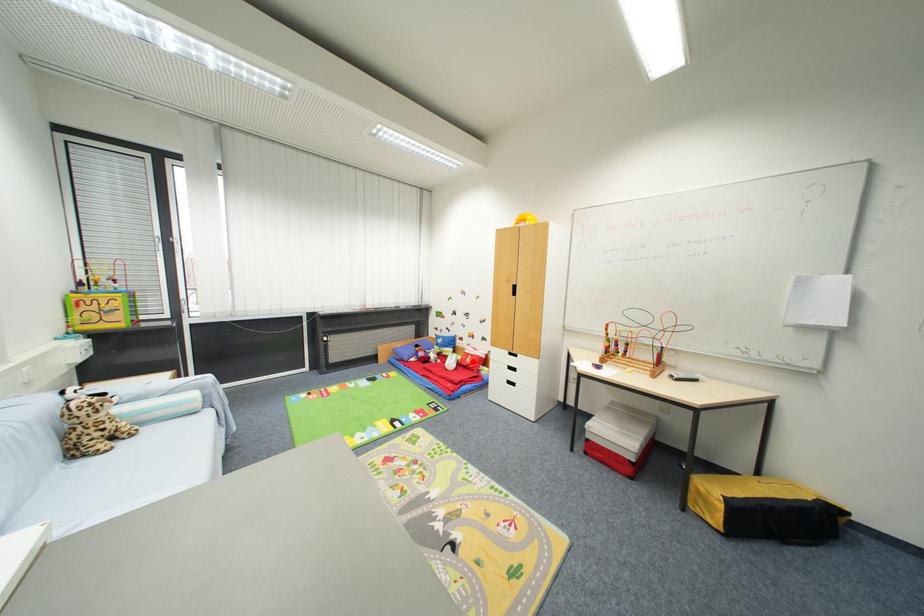
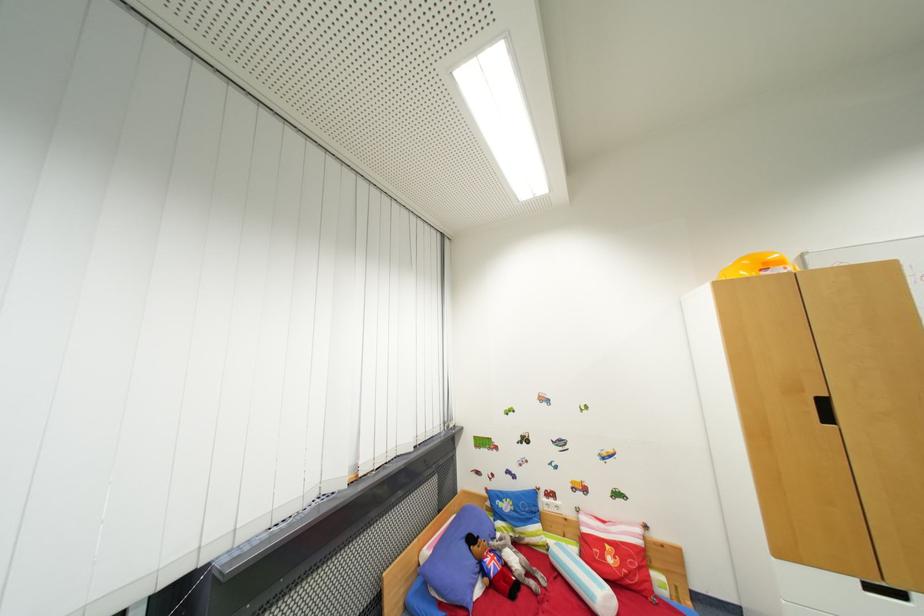
The point at the highlighted location is marked in the first image. Where is the corresponding point in the second image?

(614, 562)